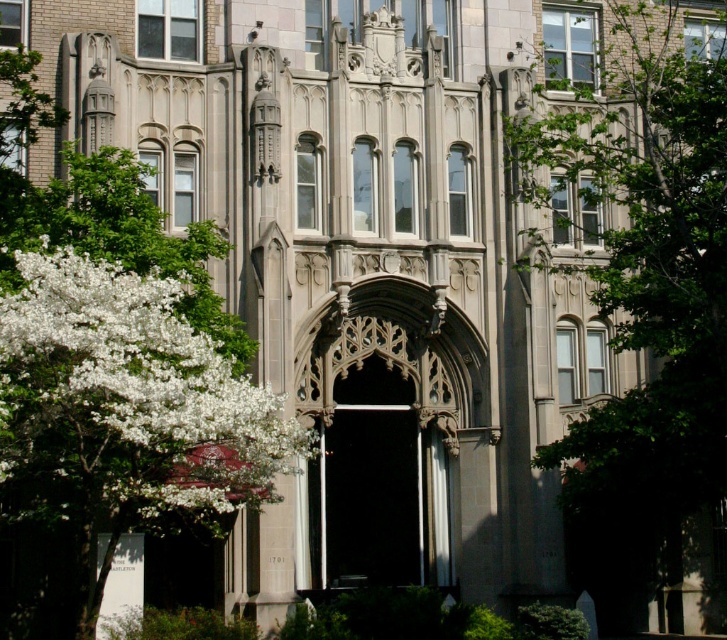
You are an architect examining this building and notice the green leafy tree at upper right and the white blossoms at left. From your vantage point, which object is closer to you?

The green leafy tree at upper right is closer to you because the white blossoms at left are positioned behind it.

You are standing in front of the building and want to take a photo of the central arched doorway. Which object, the green leafy tree at upper right or the white blossoms at left, might block your view if you position yourself too close to the building?

The green leafy tree at upper right is much taller than the white blossoms at left, so it is more likely to block your view if you position yourself too close to the building.